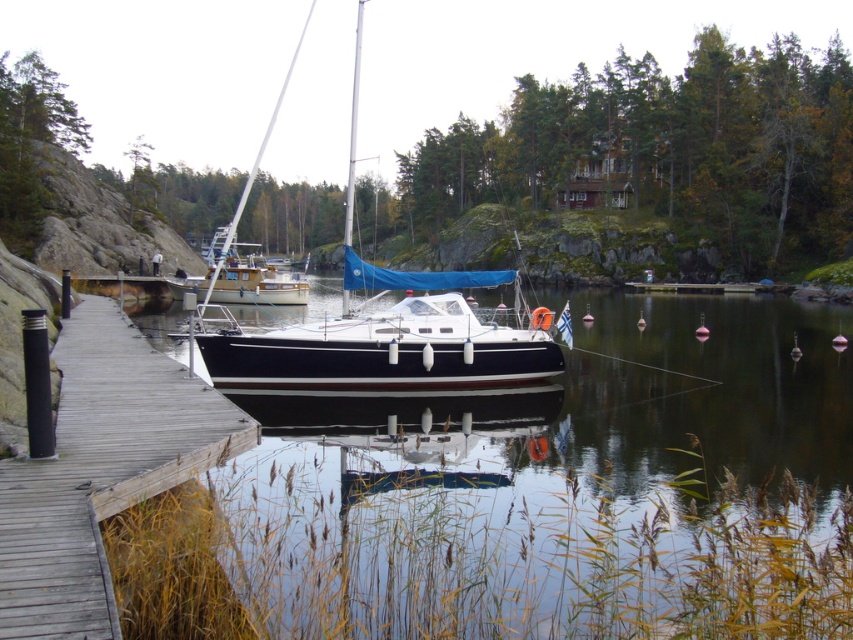
You are standing at the edge of the pier and see two points marked in the image. Which point, point [142,493] or point [389,310], is closer to you?

Point [142,493] is closer to you because it is in front of point [389,310].

You are a boat operator who needs to maneuver the black glossy sailboat at center away from the wooden dock at center. Considering the dock is narrower than the boat, what challenge might you face?

The wooden dock at center is narrower than the black glossy sailboat at center, so maneuvering the boat away might be challenging due to the dock not providing enough space for the boat to move freely.